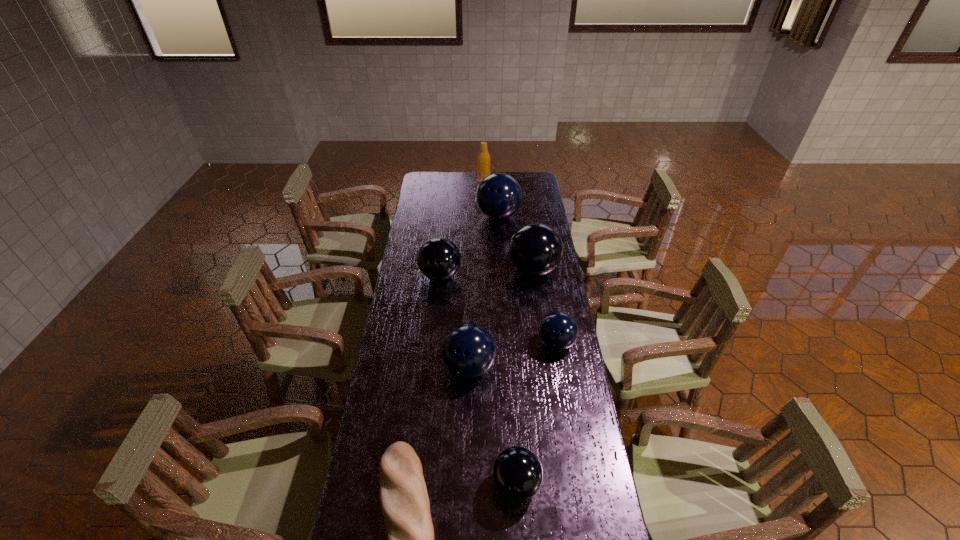
Where is `vacant space at the left edge of the desktop`? vacant space at the left edge of the desktop is located at coordinates (431, 206).

The height and width of the screenshot is (540, 960). I want to click on free space at the right edge of the desktop, so click(x=539, y=281).

At what (x,y) coordinates should I click in order to perform the action: click on free region at the far left corner. Please return your answer as a coordinate pair (x, y). The width and height of the screenshot is (960, 540). Looking at the image, I should click on (427, 174).

This screenshot has width=960, height=540. In the image, there is a desktop. What are the coordinates of `blank space at the far right corner` in the screenshot? It's located at (537, 177).

Find the location of a particular element. The height and width of the screenshot is (540, 960). free space between the smallest black bowling ball and the second smallest blue bowling ball is located at coordinates (492, 426).

Find the location of a particular element. free space between the leftmost black bowling ball and the biggest blue bowling ball is located at coordinates (469, 246).

Find the location of `unoccupied position between the biggest black bowling ball and the leftmost black bowling ball`. unoccupied position between the biggest black bowling ball and the leftmost black bowling ball is located at coordinates (487, 273).

The image size is (960, 540). I want to click on free spot between the rightmost blue bowling ball and the smallest black bowling ball, so click(537, 414).

Find the location of a particular element. This screenshot has width=960, height=540. vacant point located between the nearest black bowling ball and the leftmost black bowling ball is located at coordinates (478, 380).

The width and height of the screenshot is (960, 540). Identify the location of object that stands as the third closest to the bread. (559, 330).